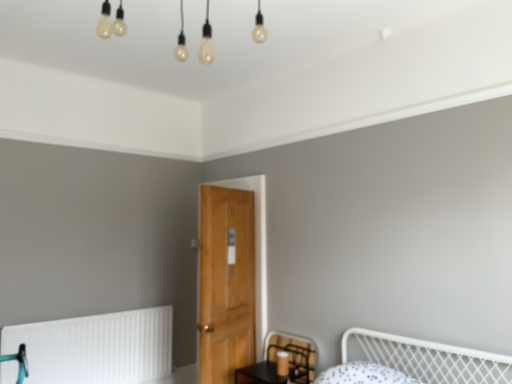
Question: Should I look upward or downward to see wooden door at center?

Choices:
 (A) up
 (B) down

Answer: (B)

Question: From the image's perspective, is white matte radiator at lower left below black mesh swivel chair at lower center?

Choices:
 (A) no
 (B) yes

Answer: (B)

Question: Is white matte radiator at lower left aimed at black mesh swivel chair at lower center?

Choices:
 (A) no
 (B) yes

Answer: (B)

Question: Is white matte radiator at lower left with black mesh swivel chair at lower center?

Choices:
 (A) no
 (B) yes

Answer: (A)

Question: Is white matte radiator at lower left closer to the viewer compared to black mesh swivel chair at lower center?

Choices:
 (A) no
 (B) yes

Answer: (A)

Question: From a real-world perspective, is white matte radiator at lower left below black mesh swivel chair at lower center?

Choices:
 (A) yes
 (B) no

Answer: (A)

Question: Considering the relative sizes of white matte radiator at lower left and black mesh swivel chair at lower center in the image provided, is white matte radiator at lower left thinner than black mesh swivel chair at lower center?

Choices:
 (A) yes
 (B) no

Answer: (A)

Question: Can you confirm if wooden door at center is bigger than black mesh swivel chair at lower center?

Choices:
 (A) yes
 (B) no

Answer: (A)

Question: Is wooden door at center not close to black mesh swivel chair at lower center?

Choices:
 (A) no
 (B) yes

Answer: (A)

Question: Is wooden door at center at the right side of black mesh swivel chair at lower center?

Choices:
 (A) no
 (B) yes

Answer: (A)

Question: Does wooden door at center have a lesser height compared to black mesh swivel chair at lower center?

Choices:
 (A) yes
 (B) no

Answer: (B)

Question: Could you tell me if wooden door at center is turned towards black mesh swivel chair at lower center?

Choices:
 (A) yes
 (B) no

Answer: (B)

Question: Does wooden door at center have a greater width compared to black mesh swivel chair at lower center?

Choices:
 (A) yes
 (B) no

Answer: (A)

Question: From the image's perspective, is black mesh swivel chair at lower center on white matte radiator at lower left?

Choices:
 (A) yes
 (B) no

Answer: (A)